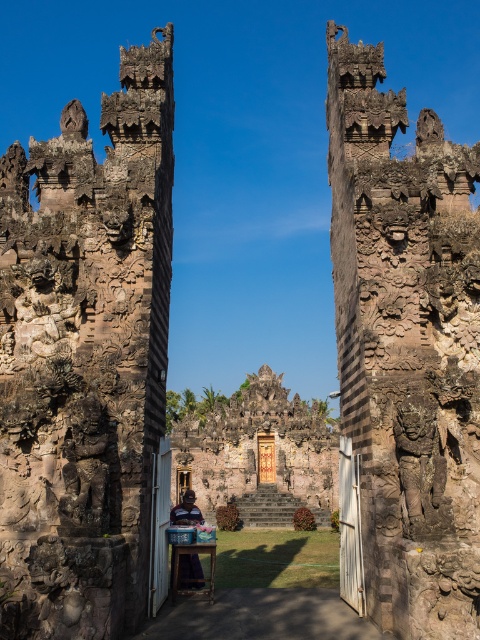
You are a visitor at the temple and want to place a small offering on the wooden stool at center. However, you notice the carved stone temple at center is in the way. Can you still place the offering without moving the stool?

The carved stone temple at center is taller than the wooden stool at center, so you can still place the offering on the wooden stool at center as the temple does not block the access to the stool.

You are a tourist visiting the Balinese temple and want to take a photo of the brown stone ruins at center and the blue fabric at center. Which object should you focus on first if you want to capture both in a single frame without zooming in or out?

The brown stone ruins at center has a smaller size compared to blue fabric at center, so you should focus on the blue fabric at center first to ensure both objects fit in the frame.

You are a visitor at the temple gate and want to take a photo that includes both the rusty stone carvings at left and the blue fabric at center. Which object should you focus on to ensure both are visible in the frame?

You should focus on the blue fabric at center because it occupies more space and can accommodate the smaller rusty stone carvings at left within the frame.